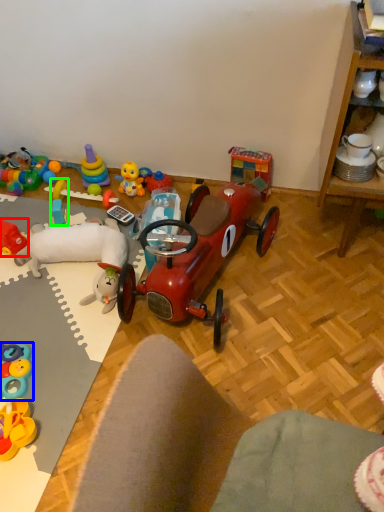
Question: Based on their relative distances, which object is nearer to toy (highlighted by a red box)? Choose from toy (highlighted by a blue box) and toy (highlighted by a green box).

Choices:
 (A) toy
 (B) toy

Answer: (B)